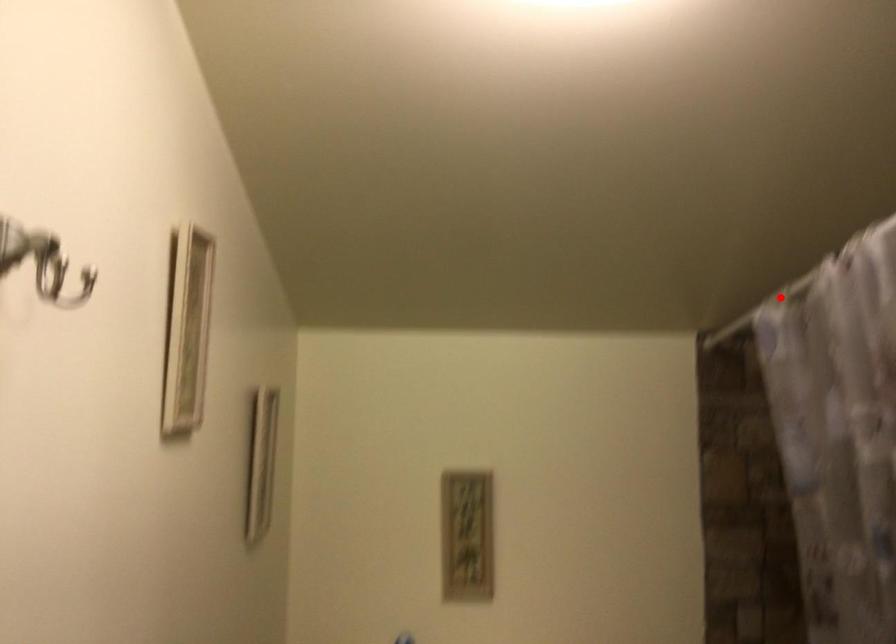
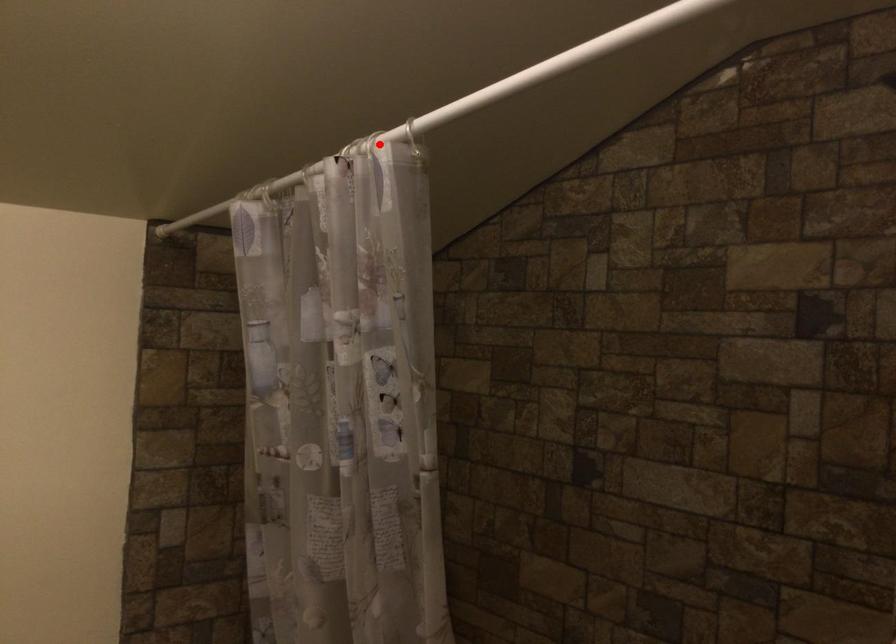
I am providing you with two images of the same scene from different viewpoints. A red point is marked on the first image and another point is marked on the second image. Does the point marked in image1 correspond to the same location as the one in image2?

No